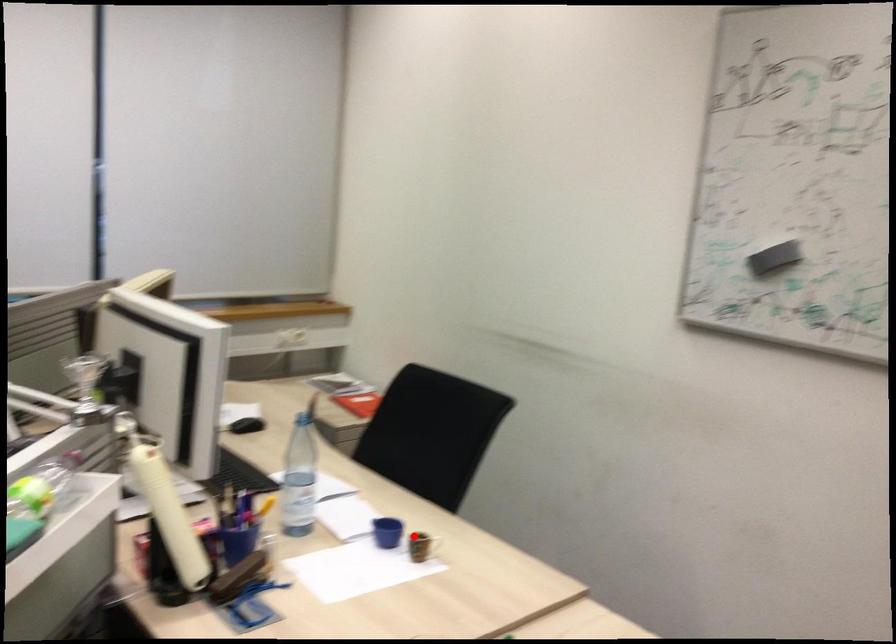
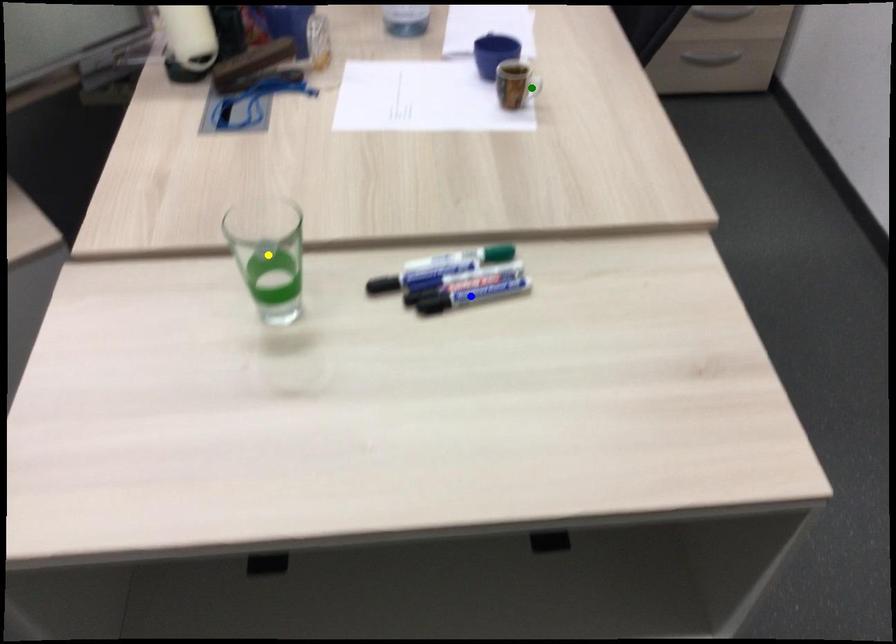
Question: I am providing you with two images of the same scene from different viewpoints. A red point is marked on the first image. You are given multiple points on the second image. Which spot in image 2 lines up with the point in image 1?

Choices:
 (A) green point
 (B) yellow point
 (C) blue point

Answer: (A)